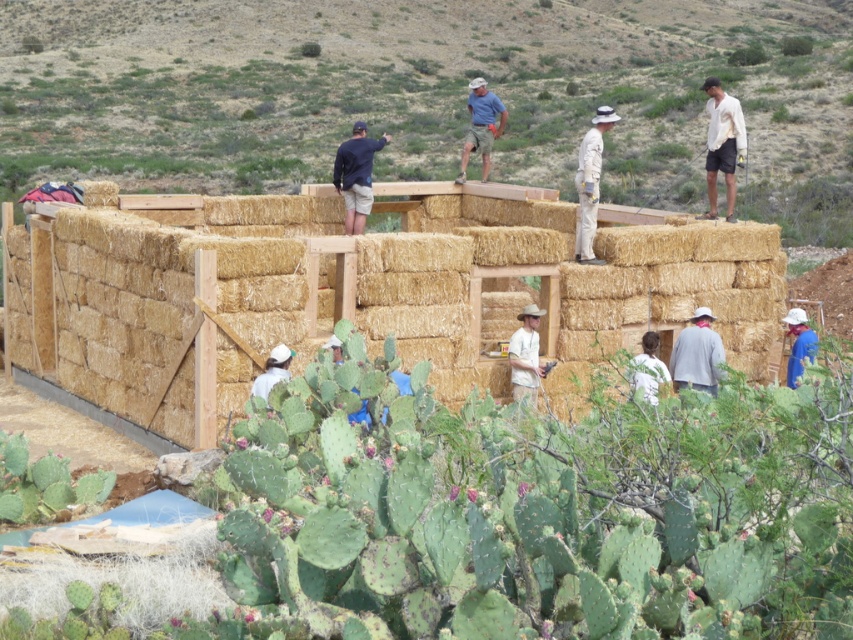
Is straw bales at upper center taller than gray cotton shirt at center?

Yes.

Locate an element on the screen. This screenshot has width=853, height=640. straw bales at upper center is located at coordinates (428, 93).

Where is `straw bales at upper center`? straw bales at upper center is located at coordinates (428, 93).

Where is `straw bales at upper center`? This screenshot has height=640, width=853. straw bales at upper center is located at coordinates (428, 93).

Is point (346, 156) less distant than point (811, 349)?

No, (346, 156) is behind (811, 349).

In the scene shown: Who is higher up, dark blue shirt at upper center or blue fabric at lower right?

Positioned higher is dark blue shirt at upper center.

Measure the distance between dark blue shirt at upper center and camera.

They are 21.58 meters apart.

This screenshot has width=853, height=640. In order to click on dark blue shirt at upper center in this screenshot , I will do `click(357, 176)`.

Can you confirm if white cotton shirt at upper right is bigger than blue fabric at lower right?

Yes, white cotton shirt at upper right is bigger than blue fabric at lower right.

Where is `white cotton shirt at upper right`? white cotton shirt at upper right is located at coordinates (722, 145).